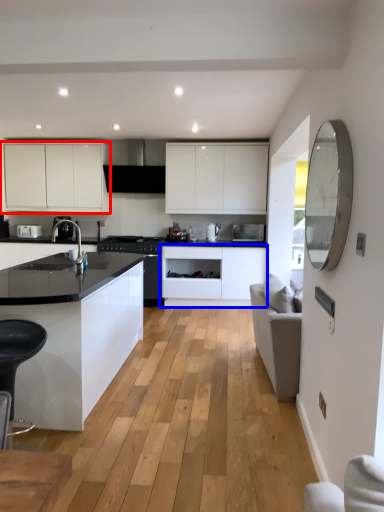
Question: Which object appears farthest to the camera in this image, cabinetry (highlighted by a red box) or cabinetry (highlighted by a blue box)?

Choices:
 (A) cabinetry
 (B) cabinetry

Answer: (A)